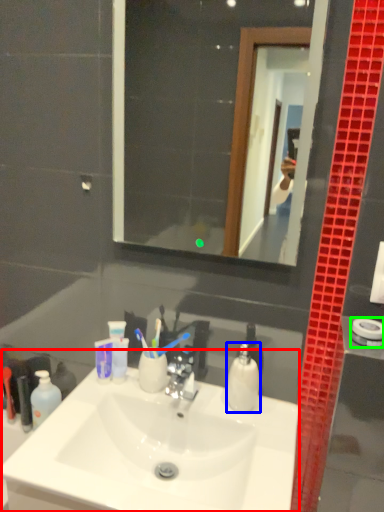
Question: Based on their relative distances, which object is nearer to sink (highlighted by a red box)? Choose from soap dispenser (highlighted by a blue box) and towel bar (highlighted by a green box).

Choices:
 (A) soap dispenser
 (B) towel bar

Answer: (A)